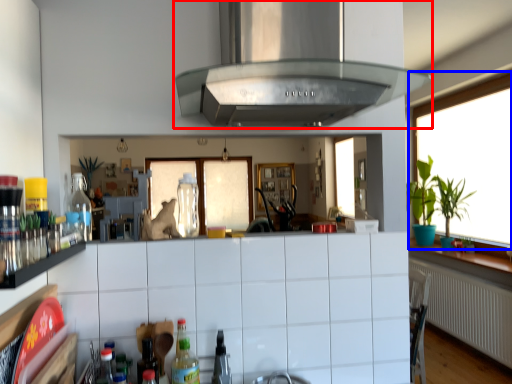
Question: Among these objects, which one is farthest to the camera, exhaust hood (highlighted by a red box) or window (highlighted by a blue box)?

Choices:
 (A) exhaust hood
 (B) window

Answer: (B)